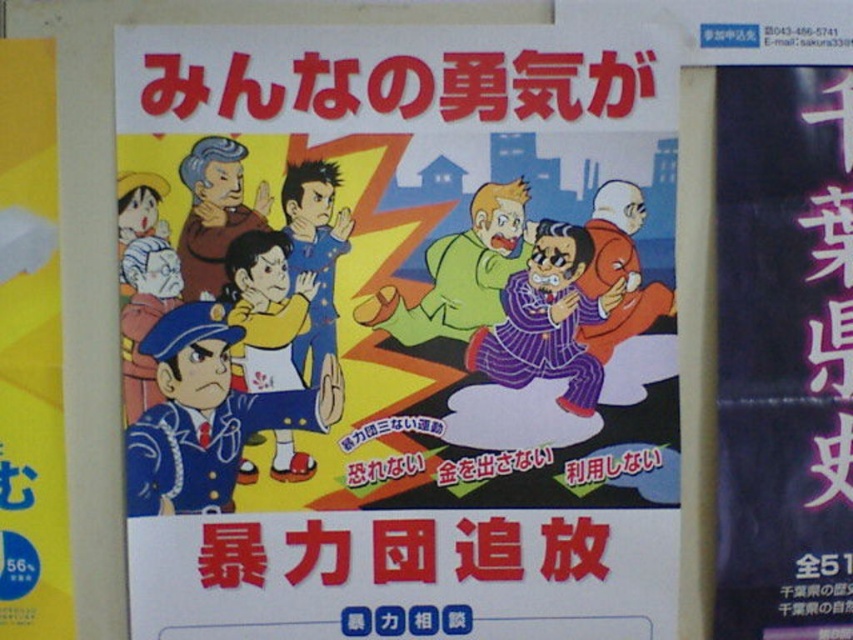
Describe the element at coordinates (398, 332) in the screenshot. I see `matte cartoon poster at center` at that location.

Is matte cartoon poster at center thinner than yellow paper at left?

In fact, matte cartoon poster at center might be wider than yellow paper at left.

In the scene shown: Who is more forward, (556, 618) or (53, 536)?

Point (53, 536) is more forward.

This screenshot has height=640, width=853. Find the location of `matte cartoon poster at center`. matte cartoon poster at center is located at coordinates (398, 332).

Does point (810, 566) lie in front of point (25, 532)?

No.

Identify the location of black paper at upper right. (782, 353).

You are a GUI agent. You are given a task and a screenshot of the screen. Output one action in this format:
    pyautogui.click(x=<x>, y=<y>)
    Task: Click on the black paper at upper right
    Image resolution: width=853 pixels, height=640 pixels.
    Given the screenshot: What is the action you would take?
    pyautogui.click(x=782, y=353)

Can you confirm if matte cartoon poster at center is shorter than black paper at upper right?

In fact, matte cartoon poster at center may be taller than black paper at upper right.

Which is more to the right, matte cartoon poster at center or black paper at upper right?

Positioned to the right is black paper at upper right.

Image resolution: width=853 pixels, height=640 pixels. I want to click on matte cartoon poster at center, so click(398, 332).